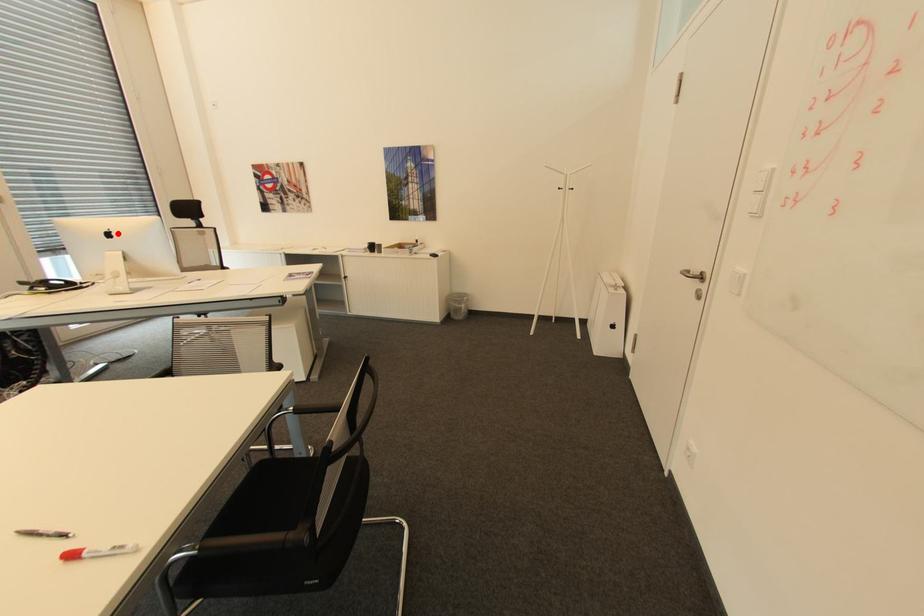
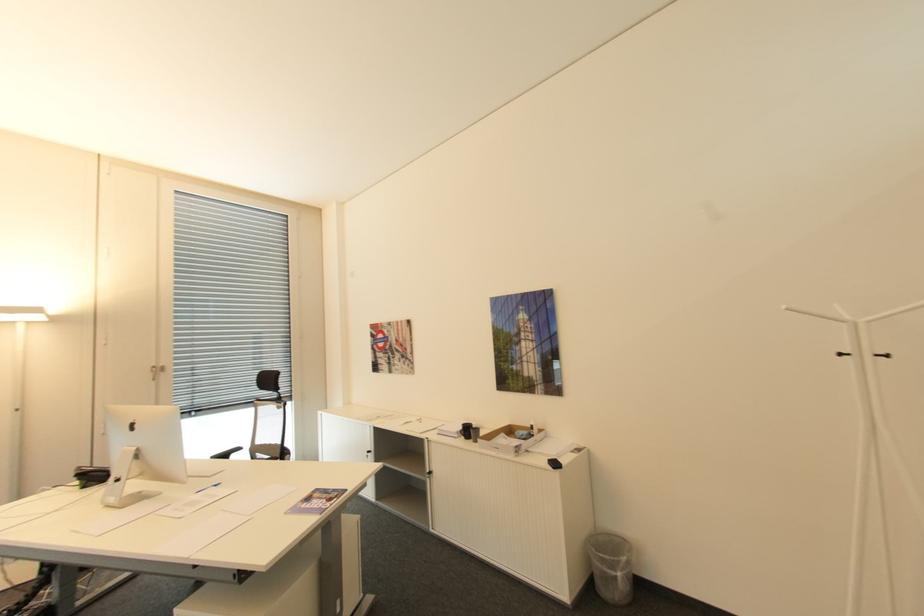
Question: I am providing you with two images of the same scene from different viewpoints. Given a red point in image1, look at the same physical point in image2. Is it:

Choices:
 (A) Closer to the viewpoint
 (B) Farther from the viewpoint

Answer: (A)